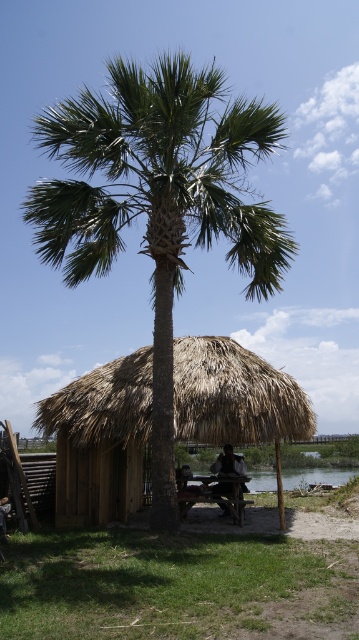
Question: Which of the following is the farthest from the observer?

Choices:
 (A) (120, 433)
 (B) (253, 131)
 (C) (198, 497)

Answer: (C)

Question: Which object appears farthest from the camera in this image?

Choices:
 (A) wooden picnic table at center
 (B) thatched wood hut at center
 (C) green leafy palm tree at center

Answer: (B)

Question: Does green leafy palm tree at center have a greater width compared to wooden picnic table at center?

Choices:
 (A) no
 (B) yes

Answer: (B)

Question: Estimate the real-world distances between objects in this image. Which object is farther from the thatched wood hut at center?

Choices:
 (A) wooden picnic table at center
 (B) green leafy palm tree at center

Answer: (B)

Question: Does green leafy palm tree at center come behind thatched wood hut at center?

Choices:
 (A) yes
 (B) no

Answer: (B)

Question: Is green leafy palm tree at center to the left of wooden picnic table at center from the viewer's perspective?

Choices:
 (A) yes
 (B) no

Answer: (A)